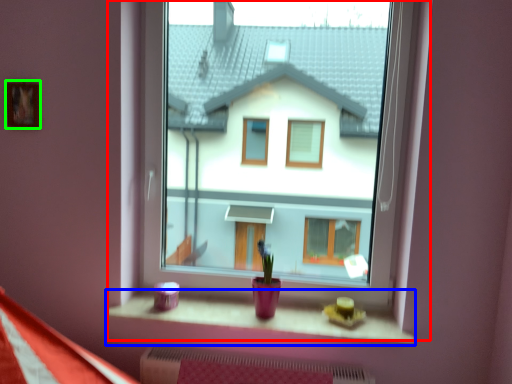
Question: Based on their relative distances, which object is nearer to window (highlighted by a red box)? Choose from window sill (highlighted by a blue box) and picture frame (highlighted by a green box).

Choices:
 (A) window sill
 (B) picture frame

Answer: (A)